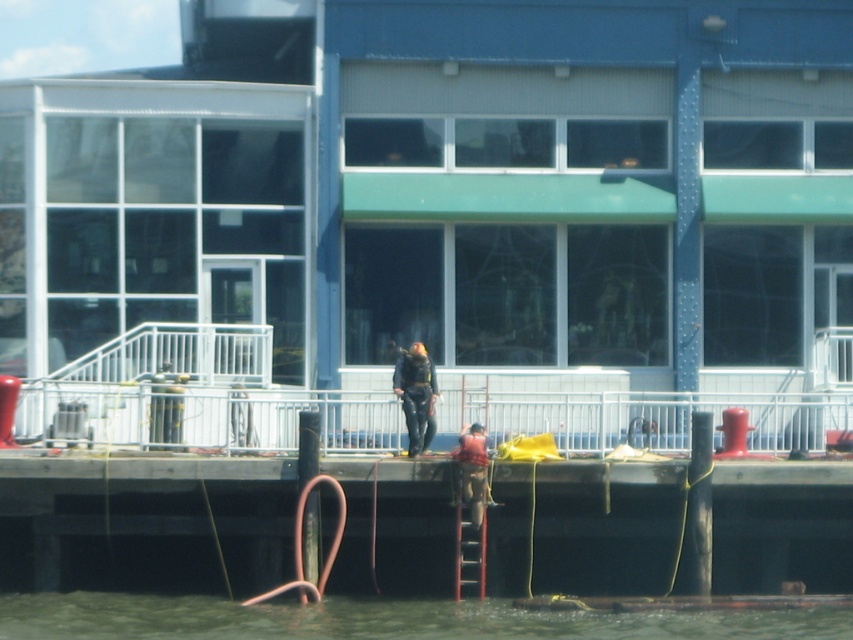
You are a delivery drone trying to land on the dock. The landing zone is marked by a point at coordinates point (202, 417). According to the scene, where exactly is this landing zone located?

The point (202, 417) is located on the white metal railing at center, so the landing zone is on the white metal railing at center.

You are a safety inspector checking the distance between the black rubber suit at center and the camera in the scene. According to safety regulations, the maximum allowed distance between safety equipment and monitoring devices is 25 meters. Is the current distance compliant with the regulation?

The black rubber suit at center and camera are 24.15 meters apart from each other. Since 24.15 meters is less than the 25 meters maximum allowed distance, the current distance is compliant with the safety regulations.